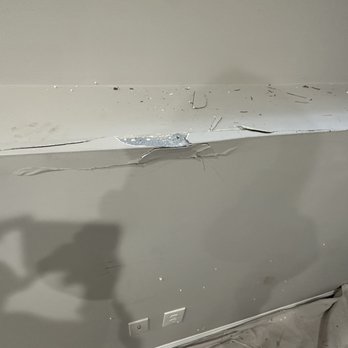
Find the location of `trash`. trash is located at coordinates (118, 82).